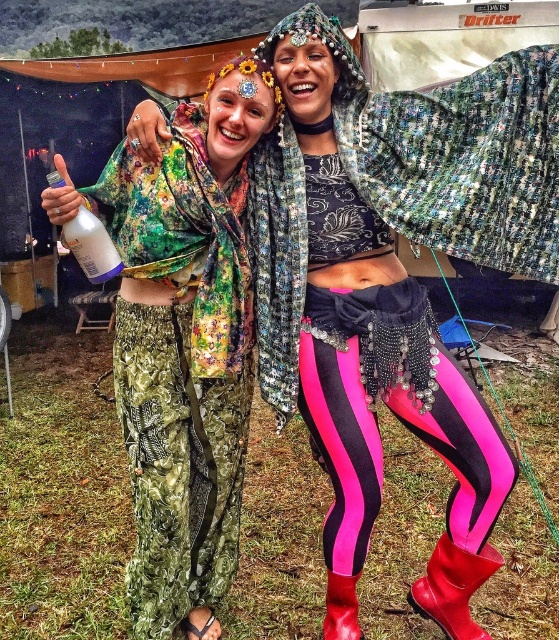
You are a photographer at the festival and need to adjust your camera to focus on both the shiny sequined shawl at upper right and the neon pink spandex leggings at center. Which object should you focus on first to ensure it appears sharp in the photo?

The shiny sequined shawl at upper right is in front of the neon pink spandex leggings at center, so you should focus on the shiny sequined shawl at upper right first to ensure it appears sharp.

You are organizing a costume party and need to decide which item takes up more space when stored. Based on the image, which object is larger between the green floral fabric skirt at lower left and the red rubber boot at lower right?

The green floral fabric skirt at lower left is larger in size than the red rubber boot at lower right, so it takes up more space when stored.

You are a photographer at the festival trying to capture a photo of both the shiny sequined shawl at upper right and the green floral fabric skirt at lower left in the same frame. Given that your camera has a maximum focus range of 18 inches, will you be able to include both items in the photo without moving closer?

The distance between the shiny sequined shawl at upper right and the green floral fabric skirt at lower left is 18.63 inches. Since the camera can only focus within 18 inches, the distance exceeds the maximum focus range. Therefore, you won cannot capture both items in the same frame without moving closer.